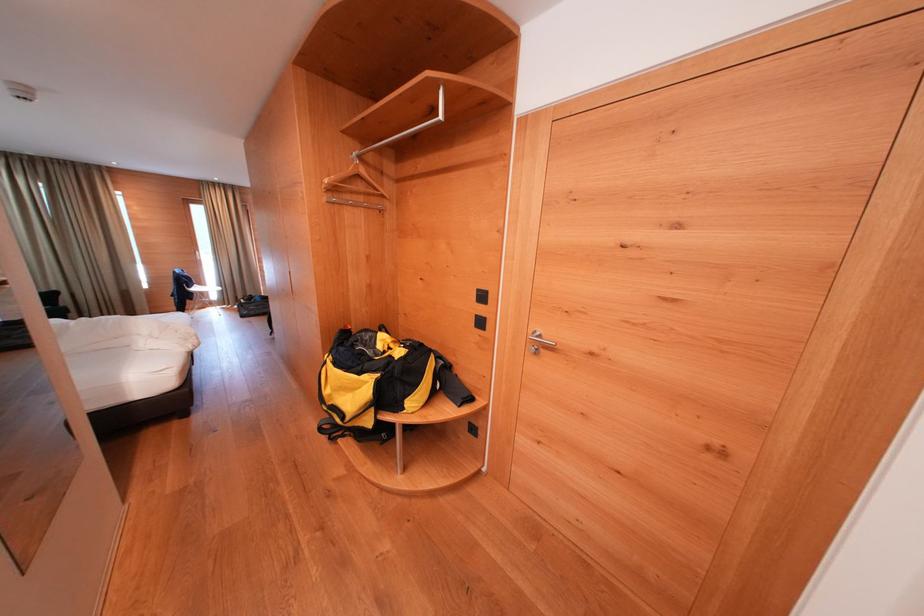
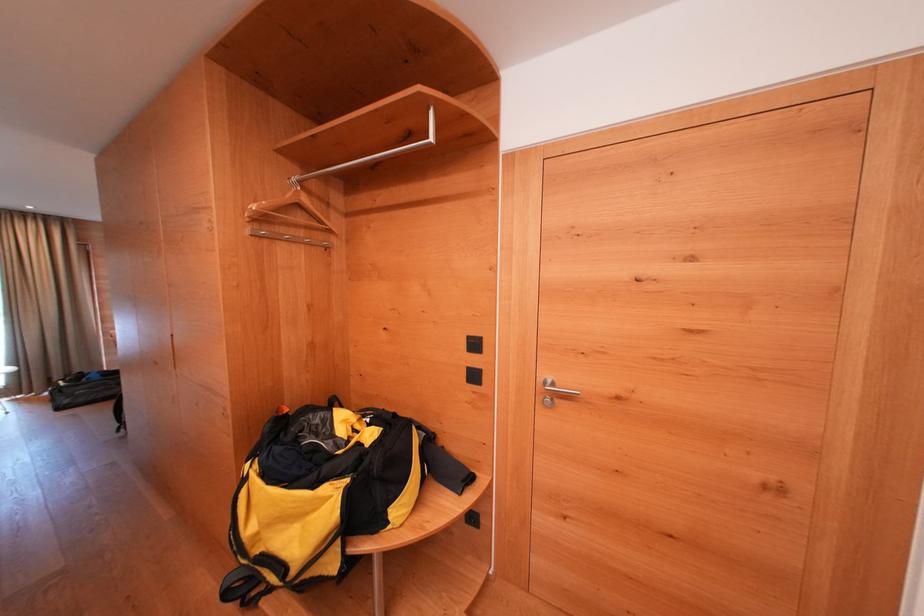
In a continuous first-person perspective shot, in which direction is the camera moving?

The movement direction of the cameraman is left, forward.